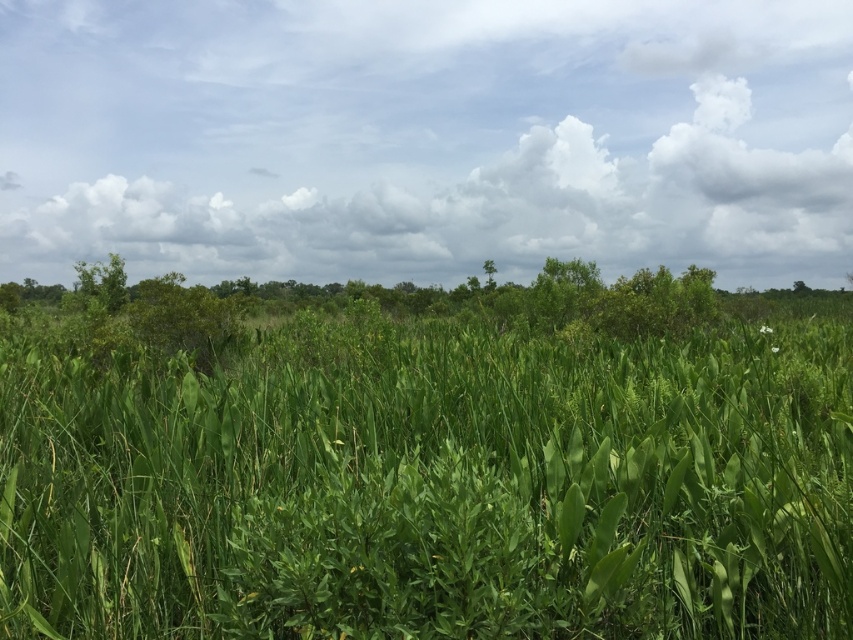
Question: Can you confirm if green leafy grass at center is smaller than cloudy sky at upper center?

Choices:
 (A) no
 (B) yes

Answer: (B)

Question: Does cloudy sky at upper center appear on the right side of green leafy tree at center?

Choices:
 (A) yes
 (B) no

Answer: (B)

Question: Which object is the farthest from the green leafy tree at center?

Choices:
 (A) green leafy grass at center
 (B) cloudy sky at upper center

Answer: (A)

Question: Can you confirm if green leafy grass at center is bigger than green leafy tree at center?

Choices:
 (A) no
 (B) yes

Answer: (B)

Question: Estimate the real-world distances between objects in this image. Which object is farther from the green leafy grass at center?

Choices:
 (A) cloudy sky at upper center
 (B) green leafy tree at center

Answer: (B)

Question: Which object appears closest to the camera in this image?

Choices:
 (A) green leafy tree at center
 (B) cloudy sky at upper center

Answer: (B)